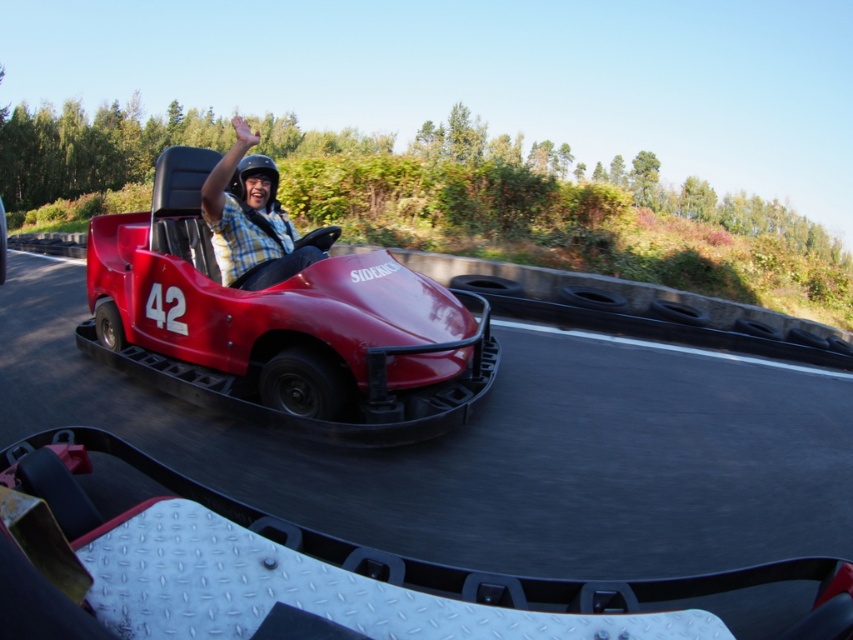
You are a photographer positioned at the center of the go kart track. You want to take a photo that includes both point [439,442] and point [225,168]. Which point will appear closer to the bottom of the photo?

Point [225,168] will appear closer to the bottom of the photo because it is closer to the camera than point [439,442].